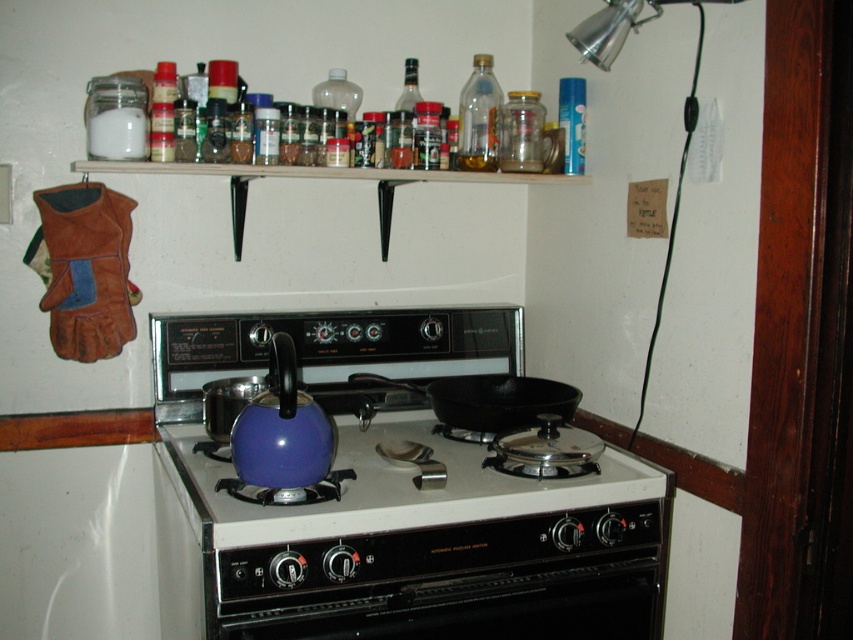
You are standing in the kitchen and need to place a new spice jar on the shelf above the stove. The shelf has limited space. Given the current arrangement, where exactly should you place the new spice jar to ensure it doesn not interfere with the matte blue kettle at center below?

Since the matte blue kettle at center is located at position point [392,497], you should place the new spice jar on the shelf above the stove in an area that does not vertically align with the kettle to avoid any interference.

You are standing in the kitchen and want to reach the point at coordinates (316, 636). If your arm can extend 4 feet, can you reach that point without moving?

The point at coordinates (316, 636) is 4.23 feet away from you, so your arm cannot reach it since it can only extend 4 feet.

You are standing in the kitchen and want to reach the point at coordinates point (428, 570). If your arm can extend 3 feet, can you reach it without moving closer?

The point (428, 570) is 4.38 feet away from you, which is farther than your arm can extend 3 feet. Therefore, you cannot reach it without moving closer.